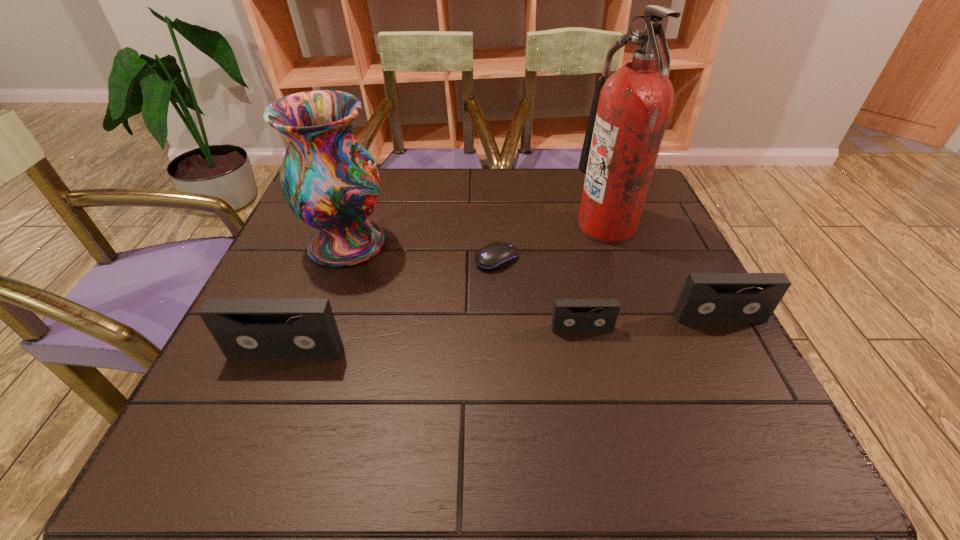
Locate an element on the screen. This screenshot has height=540, width=960. vase present at the left edge is located at coordinates (329, 180).

What are the coordinates of `videotape at the right edge` in the screenshot? It's located at (706, 297).

The height and width of the screenshot is (540, 960). Identify the location of fire extinguisher located in the right edge section of the desktop. click(630, 109).

At what (x,y) coordinates should I click in order to perform the action: click on object that is at the far right corner. Please return your answer as a coordinate pair (x, y). Looking at the image, I should click on (630, 109).

Identify the location of free spot at the far edge of the desktop. Image resolution: width=960 pixels, height=540 pixels. (493, 174).

Identify the location of free space at the near edge of the desktop. Image resolution: width=960 pixels, height=540 pixels. coord(512,371).

I want to click on vacant space at the left edge of the desktop, so click(x=267, y=359).

The width and height of the screenshot is (960, 540). In the image, there is a desktop. Find the location of `free space at the right edge`. free space at the right edge is located at coordinates (672, 293).

This screenshot has height=540, width=960. In order to click on unoccupied position between the tallest object and the nearest videotape in this screenshot , I will do `click(445, 289)`.

Identify the location of vacant space that's between the fifth farthest object and the nearest videotape. This screenshot has width=960, height=540. (434, 340).